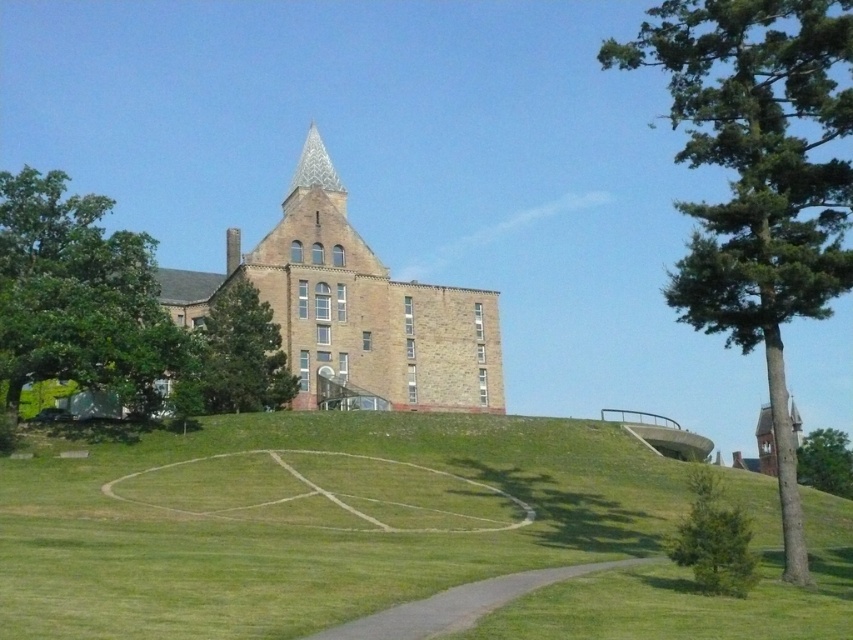
Is point (434, 296) farther from camera compared to point (477, 588)?

Yes, point (434, 296) is farther from viewer.

Does brown stone tower at center appear under gray gravel path at lower center?

No.

Locate an element on the screen. brown stone tower at center is located at coordinates (352, 307).

Does green textured pine at lower right appear on the right side of polished stone spire at upper center?

Correct, you'll find green textured pine at lower right to the right of polished stone spire at upper center.

Can you confirm if green textured pine at lower right is positioned above polished stone spire at upper center?

No, green textured pine at lower right is not above polished stone spire at upper center.

This screenshot has height=640, width=853. What do you see at coordinates (712, 540) in the screenshot?
I see `green textured pine at lower right` at bounding box center [712, 540].

Locate an element on the screen. The width and height of the screenshot is (853, 640). green textured pine at lower right is located at coordinates (712, 540).

Which is more to the right, green leafy tree at left or green leafy tree at center-right?

green leafy tree at center-right is more to the right.

Find the location of a particular element. Image resolution: width=853 pixels, height=640 pixels. green leafy tree at left is located at coordinates (78, 296).

The image size is (853, 640). I want to click on green leafy tree at left, so click(x=78, y=296).